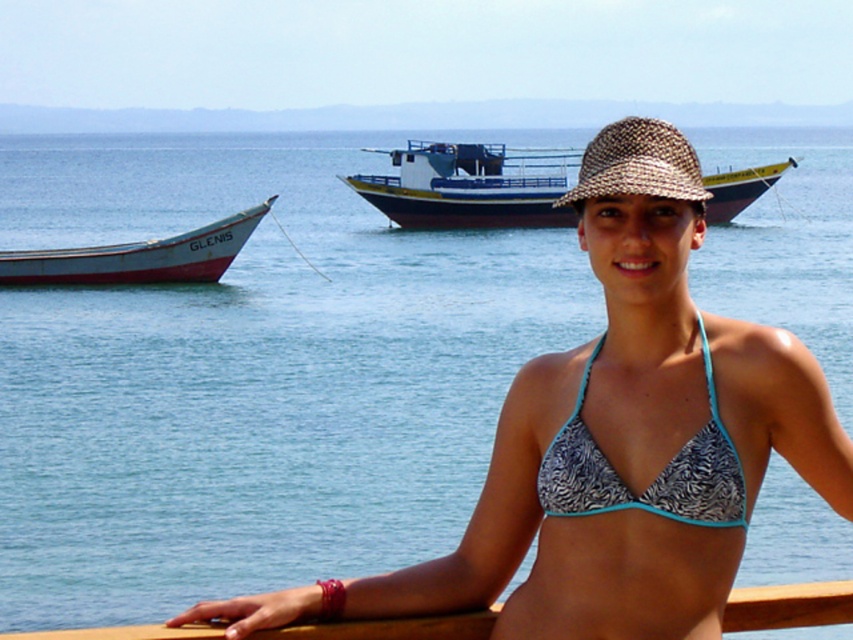
Question: Considering the real-world distances, which object is closest to the woven straw hat at center?

Choices:
 (A) printed fabric bikini top at center
 (B) white wooden boat at left

Answer: (A)

Question: Which point is closer to the camera?

Choices:
 (A) (567, 216)
 (B) (582, 177)
 (C) (540, 483)

Answer: (C)

Question: Does blue painted wooden boat at center appear over printed fabric bikini top at center?

Choices:
 (A) yes
 (B) no

Answer: (A)

Question: Is printed fabric bikini top at center smaller than woven straw hat at center?

Choices:
 (A) no
 (B) yes

Answer: (B)

Question: Which of the following is the farthest from the observer?

Choices:
 (A) (612, 472)
 (B) (47, 280)

Answer: (B)

Question: Can you confirm if white wooden boat at left is thinner than woven straw hat at center?

Choices:
 (A) no
 (B) yes

Answer: (A)